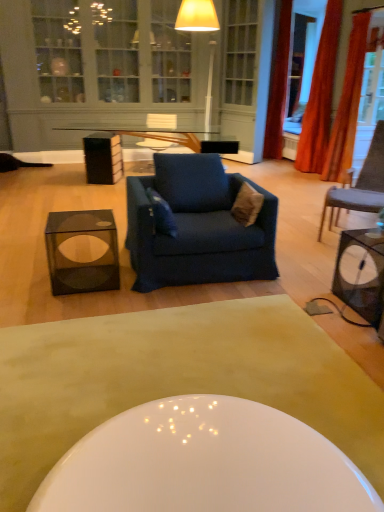
Locate an element on the screen. free space above white glossy coffee table at center, the second coffee table viewed from the top (from a real-world perspective) is located at coordinates (179, 373).